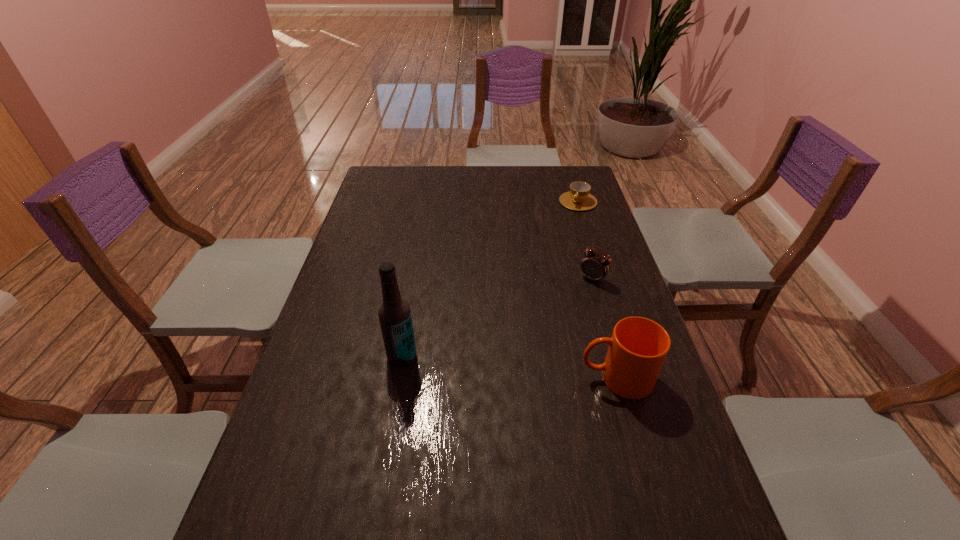
Image resolution: width=960 pixels, height=540 pixels. Find the location of `the leftmost object`. the leftmost object is located at coordinates (394, 313).

This screenshot has height=540, width=960. What are the coordinates of `the tallest object` in the screenshot? It's located at (394, 313).

You are a GUI agent. You are given a task and a screenshot of the screen. Output one action in this format:
    pyautogui.click(x=<x>, y=<y>)
    Task: Click on the mug
    Image resolution: width=960 pixels, height=540 pixels.
    Given the screenshot: What is the action you would take?
    pyautogui.click(x=638, y=347)

The image size is (960, 540). I want to click on alarm clock, so click(x=595, y=266).

Where is `the second farthest object`? This screenshot has height=540, width=960. the second farthest object is located at coordinates (595, 266).

This screenshot has height=540, width=960. What are the coordinates of `the shortest object` in the screenshot? It's located at (578, 198).

Locate an element on the screen. the farthest object is located at coordinates (578, 198).

The height and width of the screenshot is (540, 960). What are the coordinates of `vacant area located on the side of the leftmost object with the label` in the screenshot? It's located at (392, 418).

The height and width of the screenshot is (540, 960). In order to click on vacant space located on the handle side of the second tallest object in this screenshot , I will do `click(462, 378)`.

The height and width of the screenshot is (540, 960). What are the coordinates of `vacant region located 0.060m on the handle side of the second tallest object` in the screenshot? It's located at coord(555,378).